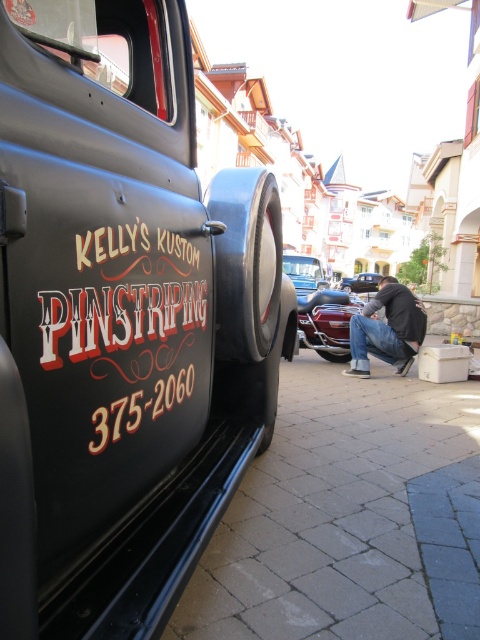
You are standing 1.73 meters away from the point at coordinates (x=163, y=413). The vintage black truck is parked on the street. Can you see the truck from where you are standing?

Yes, since you are standing 1.73 meters away from the point at coordinates (x=163, y=413), which is the distance between you and the camera, you can see the vintage black truck parked on the street as it is within your line of sight.

From the picture: You are a photographer standing in front of the vintage black truck. You want to take a photo that clearly shows both the black pinstriping at center and the black rubber tire at lower center. However, you notice that one of them is blocking your view of the other. Which object is blocking the view of the other?

The black pinstriping at center is in front of the black rubber tire at lower center, so the pinstriping is blocking the view of the tire.